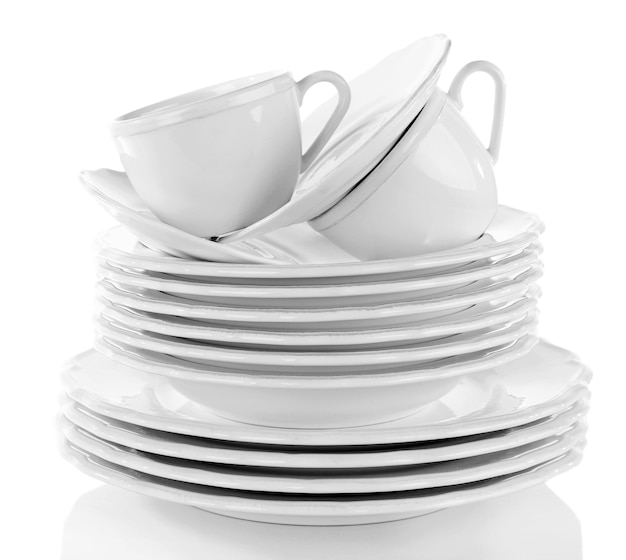
Locate an element on the screen. This screenshot has width=626, height=560. bowls is located at coordinates (364, 270), (382, 284), (387, 310), (404, 336), (409, 357), (421, 381).